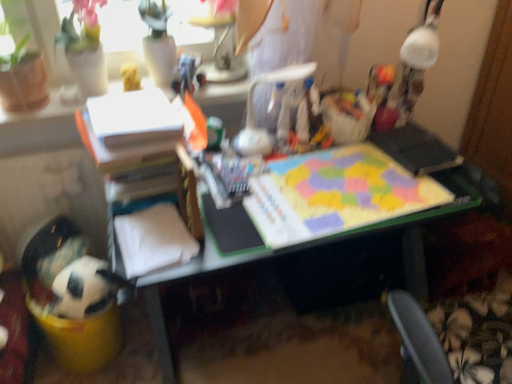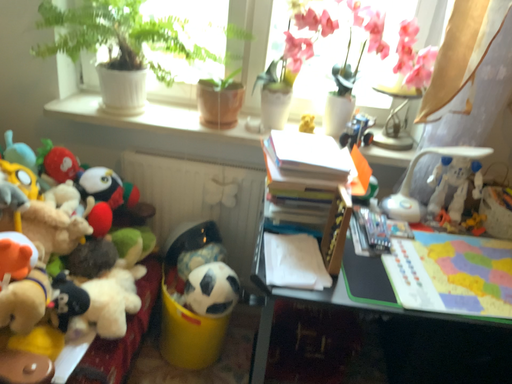
Question: How did the camera likely rotate when shooting the video?

Choices:
 (A) rotated downward
 (B) rotated upward

Answer: (B)